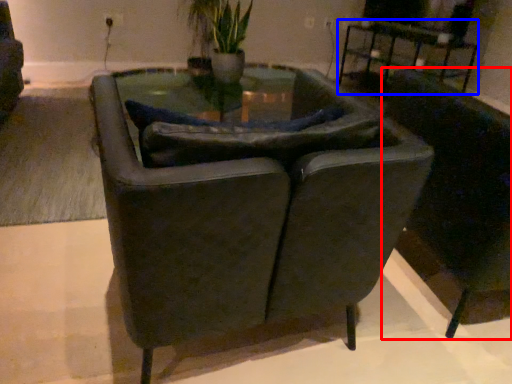
Question: Which object is closer to the camera taking this photo, chair (highlighted by a red box) or table (highlighted by a blue box)?

Choices:
 (A) chair
 (B) table

Answer: (A)